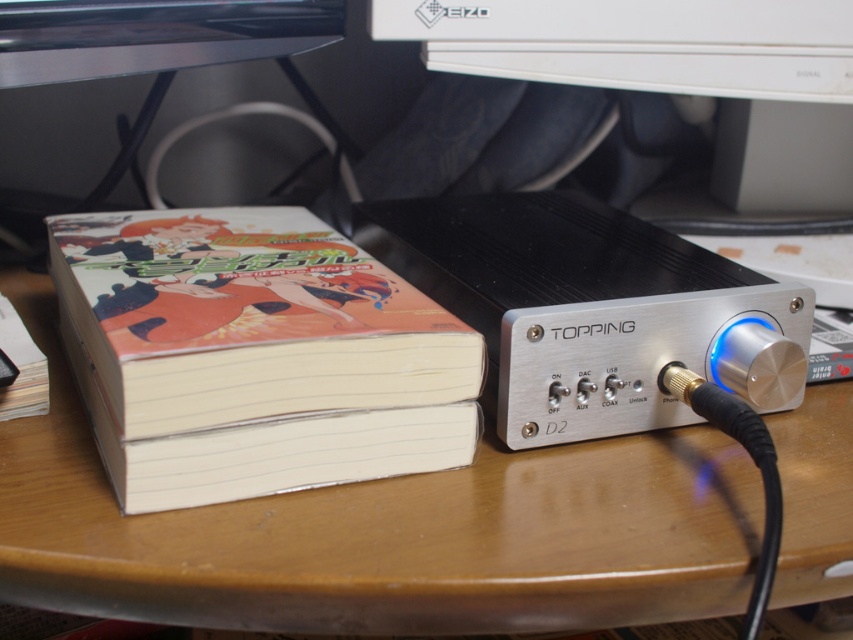
You are organizing a desk and need to place both the matte paperback book at left and the white plastic monitor at upper center side by side. Which object should you place first to ensure they fit properly?

The matte paperback book at left has a lesser width compared to the white plastic monitor at upper center. Therefore, you should place the wider white plastic monitor at upper center first to accommodate its larger size, then position the narrower matte paperback book at left next to it.

You are organizing a desk and need to place both the matte paperback book at left and the white plastic monitor at upper center. Which object should you prioritize placing first to accommodate their sizes?

The matte paperback book at left is larger in size than the white plastic monitor at upper center, so you should prioritize placing the matte paperback book at left first to ensure there is enough space for it on the desk.